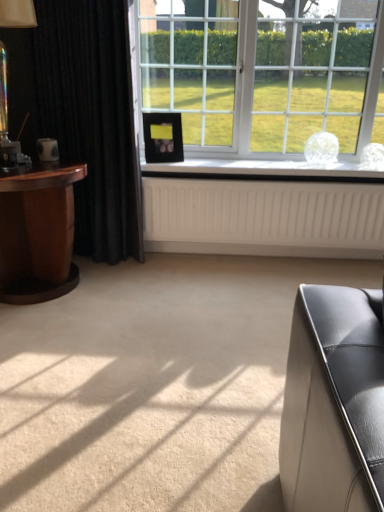
Question: Could you tell me if mahogany wood side table at left is facing clear glass window at center?

Choices:
 (A) no
 (B) yes

Answer: (B)

Question: Considering the relative positions of mahogany wood side table at left and clear glass window at center in the image provided, is mahogany wood side table at left to the right of clear glass window at center from the viewer's perspective?

Choices:
 (A) yes
 (B) no

Answer: (B)

Question: Is mahogany wood side table at left at the left side of clear glass window at center?

Choices:
 (A) yes
 (B) no

Answer: (A)

Question: Can you confirm if mahogany wood side table at left is shorter than clear glass window at center?

Choices:
 (A) yes
 (B) no

Answer: (A)

Question: Is mahogany wood side table at left far from clear glass window at center?

Choices:
 (A) yes
 (B) no

Answer: (A)

Question: Considering the relative sizes of mahogany wood side table at left and clear glass window at center in the image provided, is mahogany wood side table at left smaller than clear glass window at center?

Choices:
 (A) yes
 (B) no

Answer: (A)

Question: Is mahogany wood side table at left wider than black matte picture frame at center?

Choices:
 (A) no
 (B) yes

Answer: (B)

Question: Would you say black matte picture frame at center is part of mahogany wood side table at left's contents?

Choices:
 (A) no
 (B) yes

Answer: (A)

Question: Does mahogany wood side table at left turn towards black matte picture frame at center?

Choices:
 (A) no
 (B) yes

Answer: (A)

Question: Does mahogany wood side table at left appear on the left side of black matte picture frame at center?

Choices:
 (A) yes
 (B) no

Answer: (A)

Question: From a real-world perspective, is mahogany wood side table at left positioned over black matte picture frame at center based on gravity?

Choices:
 (A) yes
 (B) no

Answer: (B)

Question: Can you confirm if mahogany wood side table at left is smaller than black matte picture frame at center?

Choices:
 (A) no
 (B) yes

Answer: (A)

Question: Is clear glass window at center not near translucent glass table lamp at left?

Choices:
 (A) no
 (B) yes

Answer: (B)